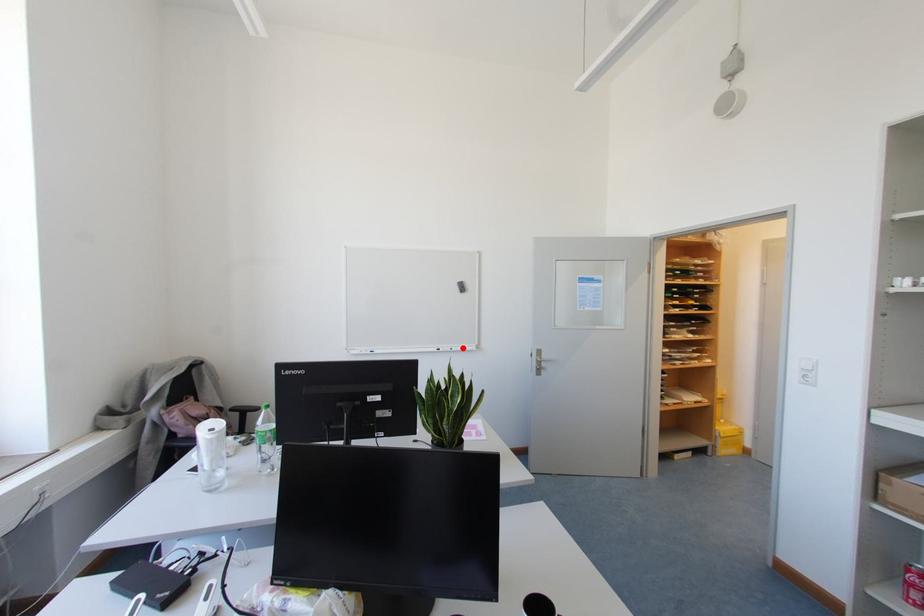
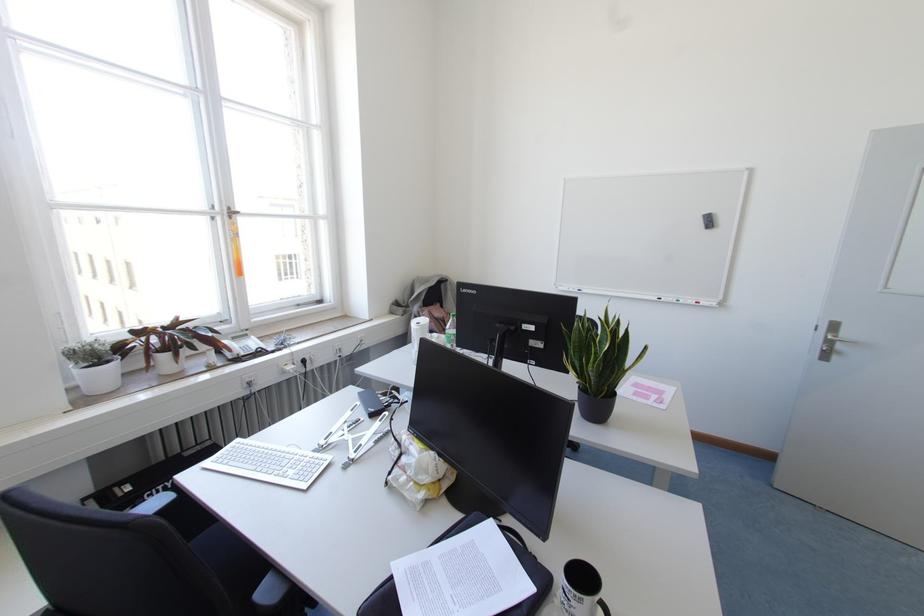
Locate, in the second image, the point that corresponds to the highlighted location in the first image.

(696, 302)